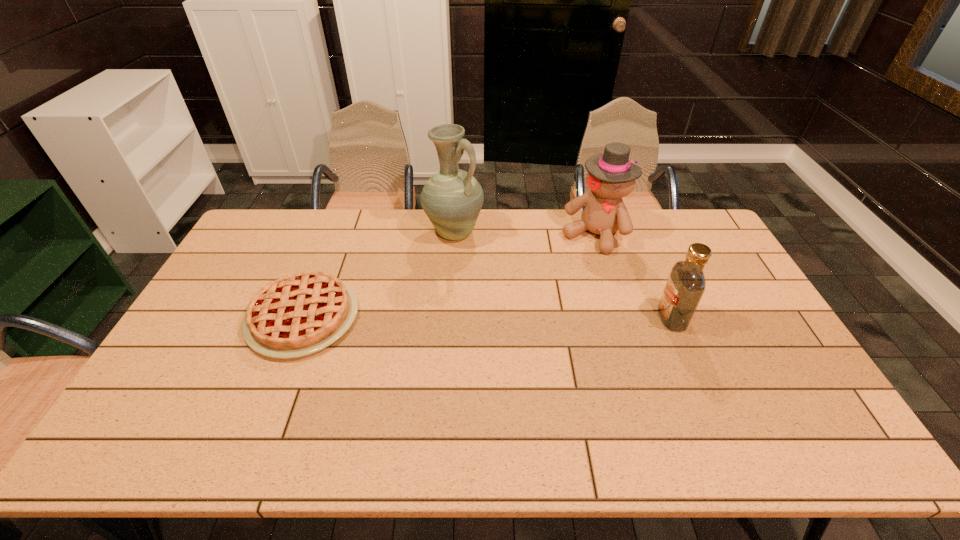
What are the coordinates of `free space on the desktop that is between the pie and the vodka and is positioned on the handle side of the tallest object` in the screenshot? It's located at click(x=525, y=317).

Find the location of a particular element. vacant space on the desktop that is between the pie and the rightmost object and is positioned on the front-facing side of the second object from right to left is located at coordinates click(x=529, y=317).